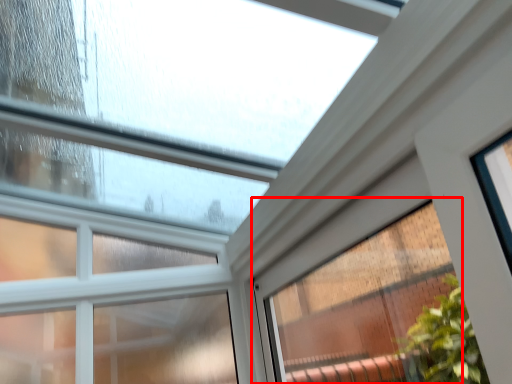
Question: Considering the relative positions of window (annotated by the red box) and window in the image provided, where is window (annotated by the red box) located with respect to the staircase?

Choices:
 (A) left
 (B) right

Answer: (B)